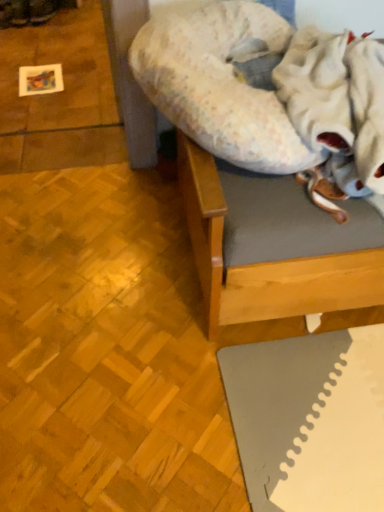
Question: Is wooden bed frame at upper right next to fluffy white blanket at upper right and touching it?

Choices:
 (A) yes
 (B) no

Answer: (B)

Question: From the image's perspective, is wooden bed frame at upper right over fluffy white blanket at upper right?

Choices:
 (A) no
 (B) yes

Answer: (A)

Question: Is wooden bed frame at upper right far away from fluffy white blanket at upper right?

Choices:
 (A) no
 (B) yes

Answer: (A)

Question: Is wooden bed frame at upper right shorter than fluffy white blanket at upper right?

Choices:
 (A) no
 (B) yes

Answer: (A)

Question: Is wooden bed frame at upper right at the left side of fluffy white blanket at upper right?

Choices:
 (A) no
 (B) yes

Answer: (A)

Question: Looking at their shapes, would you say wooden bed frame at upper right is wider or thinner than fluffy fabric dog bed at upper center?

Choices:
 (A) thin
 (B) wide

Answer: (B)

Question: Considering the positions of wooden bed frame at upper right and fluffy fabric dog bed at upper center in the image, is wooden bed frame at upper right taller or shorter than fluffy fabric dog bed at upper center?

Choices:
 (A) tall
 (B) short

Answer: (A)

Question: Considering the positions of wooden bed frame at upper right and fluffy fabric dog bed at upper center in the image, is wooden bed frame at upper right bigger or smaller than fluffy fabric dog bed at upper center?

Choices:
 (A) big
 (B) small

Answer: (A)

Question: Would you say wooden bed frame at upper right is inside or outside fluffy fabric dog bed at upper center?

Choices:
 (A) outside
 (B) inside

Answer: (A)

Question: Is fluffy white blanket at upper right taller or shorter than fluffy fabric dog bed at upper center?

Choices:
 (A) short
 (B) tall

Answer: (B)

Question: Is fluffy white blanket at upper right inside the boundaries of fluffy fabric dog bed at upper center, or outside?

Choices:
 (A) inside
 (B) outside

Answer: (B)

Question: Is fluffy white blanket at upper right bigger or smaller than fluffy fabric dog bed at upper center?

Choices:
 (A) small
 (B) big

Answer: (A)

Question: Is fluffy white blanket at upper right wider or thinner than fluffy fabric dog bed at upper center?

Choices:
 (A) wide
 (B) thin

Answer: (B)

Question: From a real-world perspective, is wooden bed frame at upper right physically located above or below fluffy white blanket at upper right?

Choices:
 (A) above
 (B) below

Answer: (B)

Question: Looking at their shapes, would you say wooden bed frame at upper right is wider or thinner than fluffy white blanket at upper right?

Choices:
 (A) thin
 (B) wide

Answer: (B)